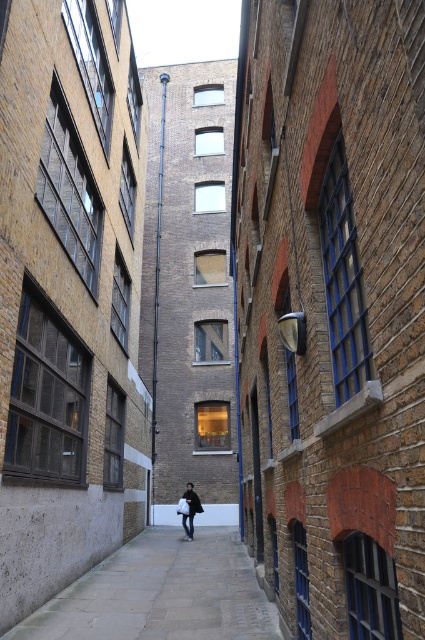
You are standing at the entrance of the alleyway and see the point marked at coordinates (x=161, y=593). Based on the scene description, what is the location of this point relative to the buildings?

The point at coordinates (x=161, y=593) corresponds to the paved stone pavement at center, which is located between the two tall brick buildings in the alleyway.

You are a delivery person trying to navigate through the alley. You need to know if the paved stone pavement at center is higher than the dark brown leather coat at center. Can you confirm?

The paved stone pavement at center is taller than dark brown leather coat at center, so yes, the pavement is higher than the coat.